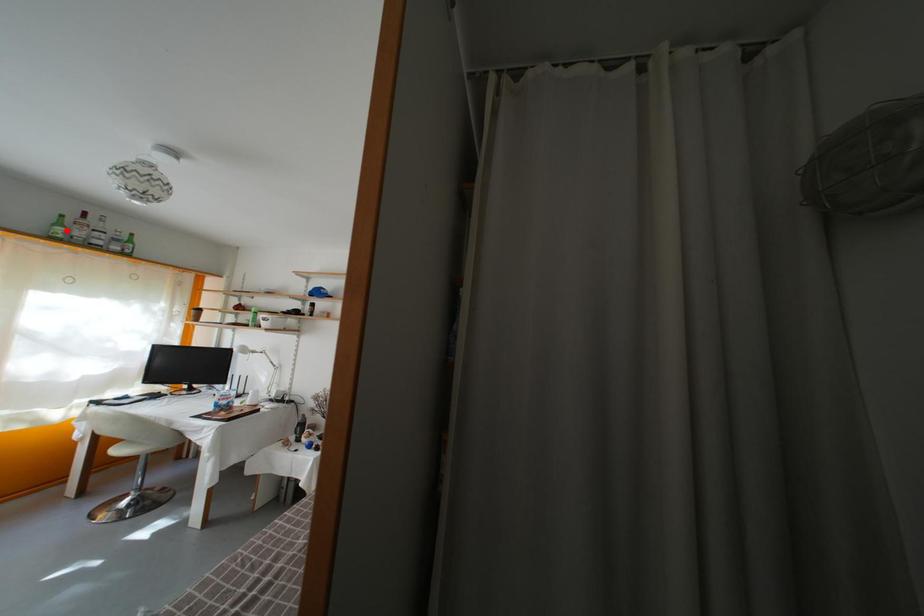
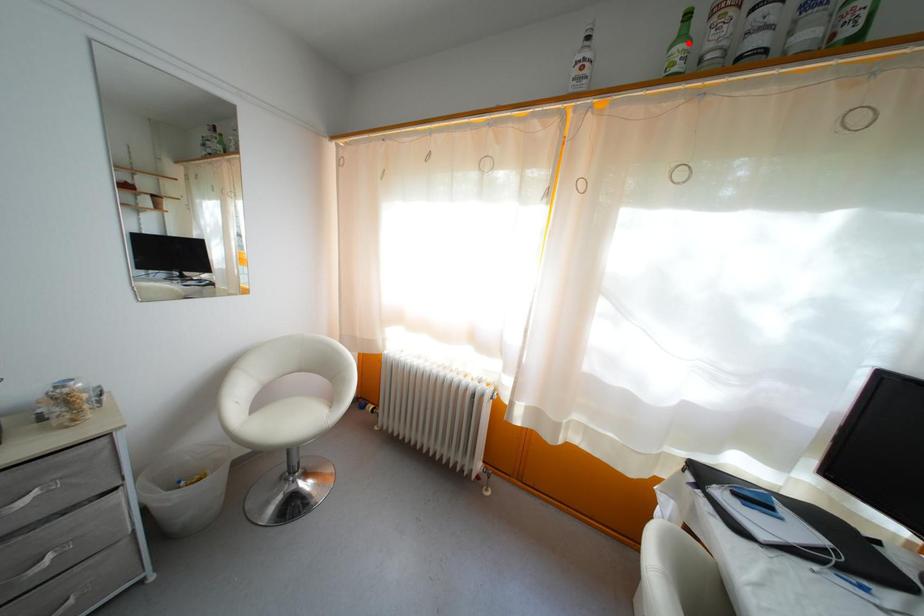
Based on the photo, I am providing you with two images of the same scene from different viewpoints. A red point is marked on the first image and another point is marked on the second image. Is the red point in image1 aligned with the point shown in image2?

Yes